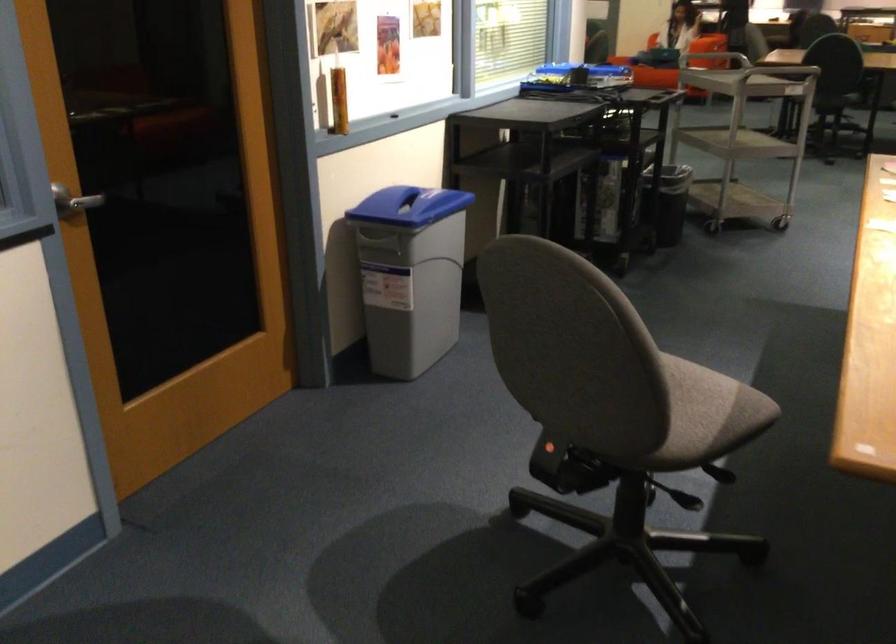
This screenshot has height=644, width=896. What are the coordinates of `clear water bottle` in the screenshot? It's located at (607, 200).